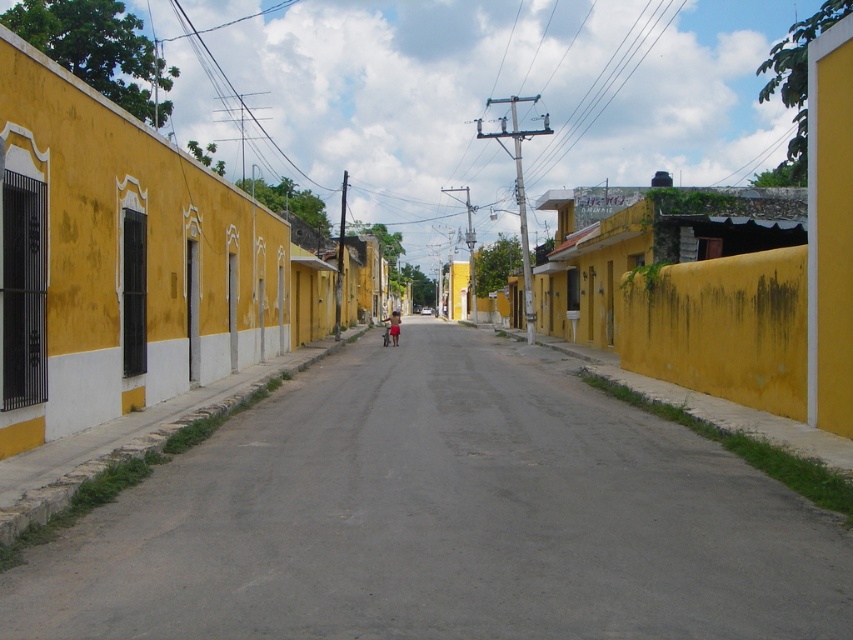
Who is positioned more to the left, smooth asphalt road at center or light brown skin at center?

light brown skin at center is more to the left.

Measure the distance from smooth asphalt road at center to light brown skin at center.

smooth asphalt road at center is 23.45 meters away from light brown skin at center.

Does point (753, 625) come behind point (383, 333)?

No, it is in front of (383, 333).

The image size is (853, 640). In order to click on smooth asphalt road at center in this screenshot , I will do `click(442, 518)`.